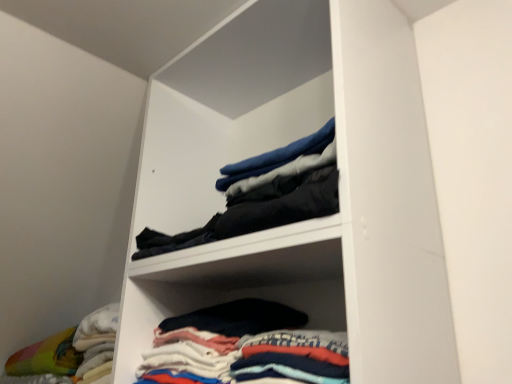
I want to click on dark blue fabric at upper center, so click(x=262, y=196).

Describe the element at coordinates (262, 196) in the screenshot. I see `dark blue fabric at upper center` at that location.

The height and width of the screenshot is (384, 512). Identify the location of dark blue fabric at upper center. (262, 196).